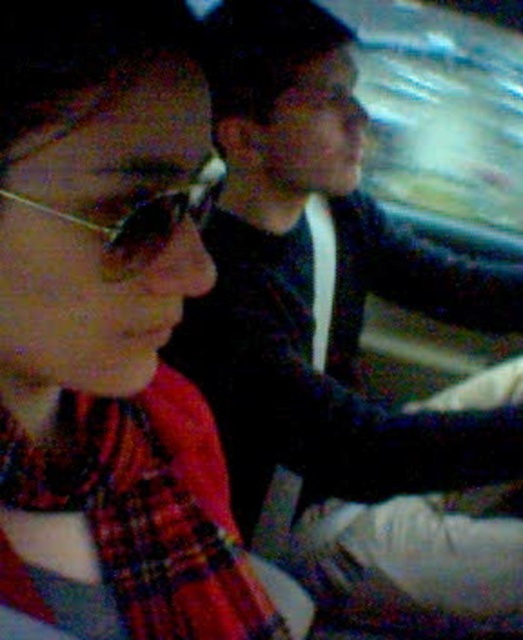
Question: Which point is farther from the camera taking this photo?

Choices:
 (A) (134, 224)
 (B) (88, 237)
 (C) (374, 582)

Answer: (C)

Question: Can you confirm if black matte shirt at center is positioned below metallic reflective glasses at upper left?

Choices:
 (A) no
 (B) yes

Answer: (B)

Question: Is the position of black matte shirt at center more distant than that of metallic reflective glasses at upper left?

Choices:
 (A) yes
 (B) no

Answer: (A)

Question: Which point is farther to the camera?

Choices:
 (A) black matte shirt at center
 (B) metallic reflective glasses at upper left

Answer: (A)

Question: Which point appears farthest from the camera in this image?

Choices:
 (A) (101, 76)
 (B) (213, 163)

Answer: (B)

Question: Can you confirm if plaid fabric scarf at left is smaller than black matte shirt at center?

Choices:
 (A) yes
 (B) no

Answer: (A)